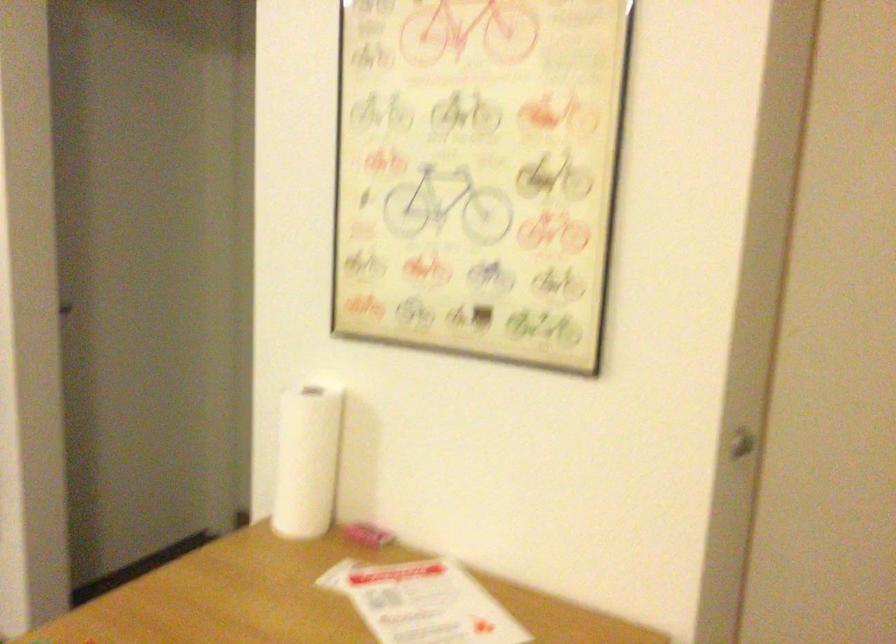
Question: The images are taken continuously from a first-person perspective. In which direction is your viewpoint rotating?

Choices:
 (A) Left
 (B) Right
 (C) Up
 (D) Down

Answer: (A)